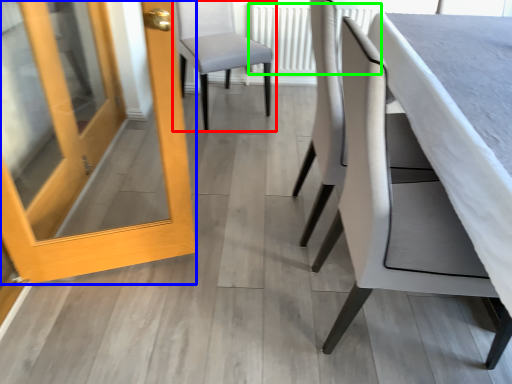
Question: Which object is the closest to the chair (highlighted by a red box)? Choose among these: door (highlighted by a blue box) or radiator (highlighted by a green box).

Choices:
 (A) door
 (B) radiator

Answer: (B)